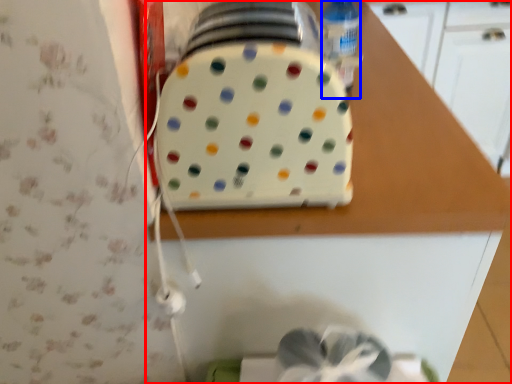
Question: Which object is closer to the camera taking this photo, countertop (highlighted by a red box) or bottle (highlighted by a blue box)?

Choices:
 (A) countertop
 (B) bottle

Answer: (A)